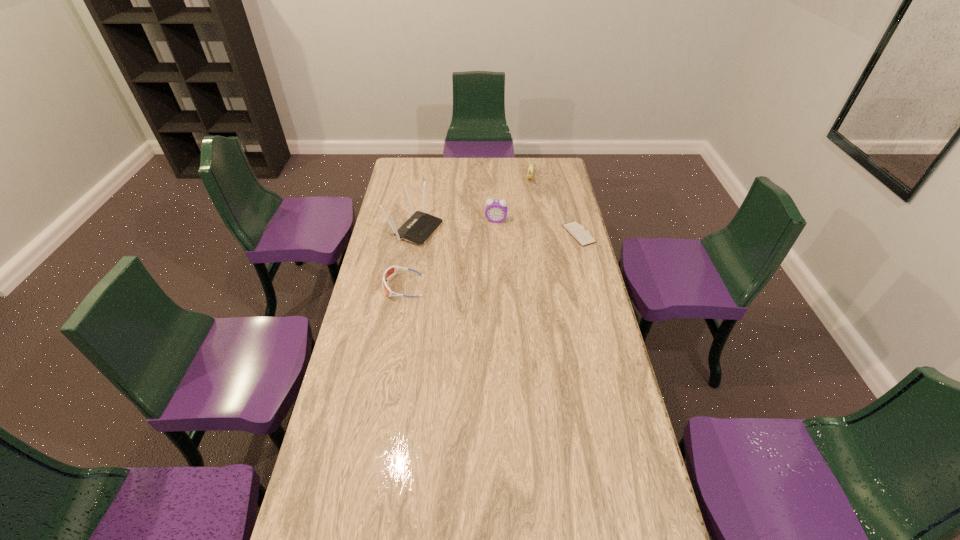
Locate an element on the screen. object that stands as the closest to the third object from left to right is located at coordinates (417, 229).

Choose which object is the fourth nearest neighbor to the tallest object. Please provide its 2D coordinates. Your answer should be formatted as a tuple, i.e. [(x, y)], where the tuple contains the x and y coordinates of a point satisfying the conditions above.

[(577, 231)]

The image size is (960, 540). Identify the location of vacant point that satisfies the following two spatial constraints: 1. on the back side of the third tallest object; 2. on the left side of the third object from left to right. (494, 178).

The image size is (960, 540). In order to click on free space that satisfies the following two spatial constraints: 1. on the front side of the rightmost object; 2. on the left side of the tallest object in this screenshot , I will do `click(414, 234)`.

You are a GUI agent. You are given a task and a screenshot of the screen. Output one action in this format:
    pyautogui.click(x=<x>, y=<y>)
    Task: Click on the free space that satisfies the following two spatial constraints: 1. on the back side of the farthest object; 2. on the left side of the tallest object
    The height and width of the screenshot is (540, 960).
    Given the screenshot: What is the action you would take?
    pyautogui.click(x=423, y=178)